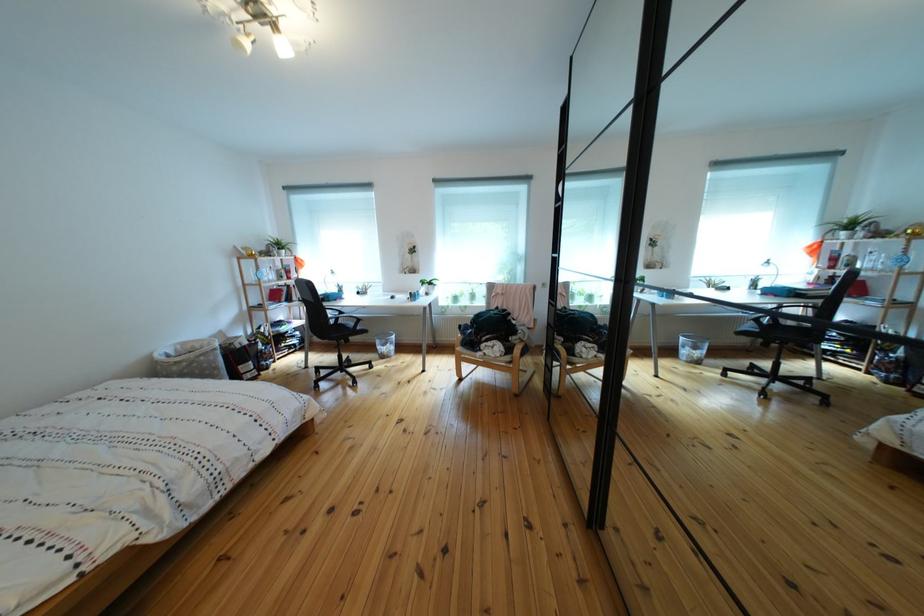
Find the location of a particular element. wooden chair armrest is located at coordinates [x=339, y=314].